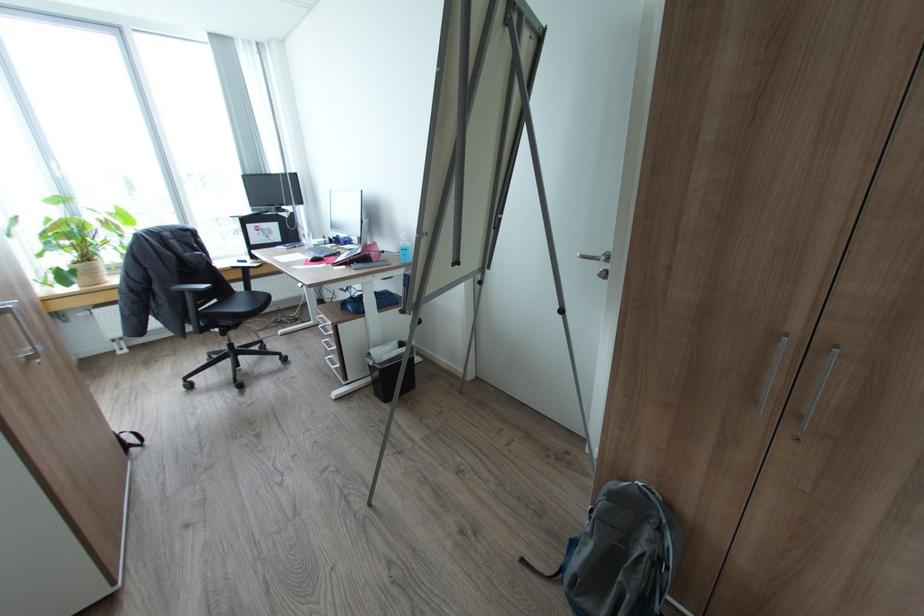
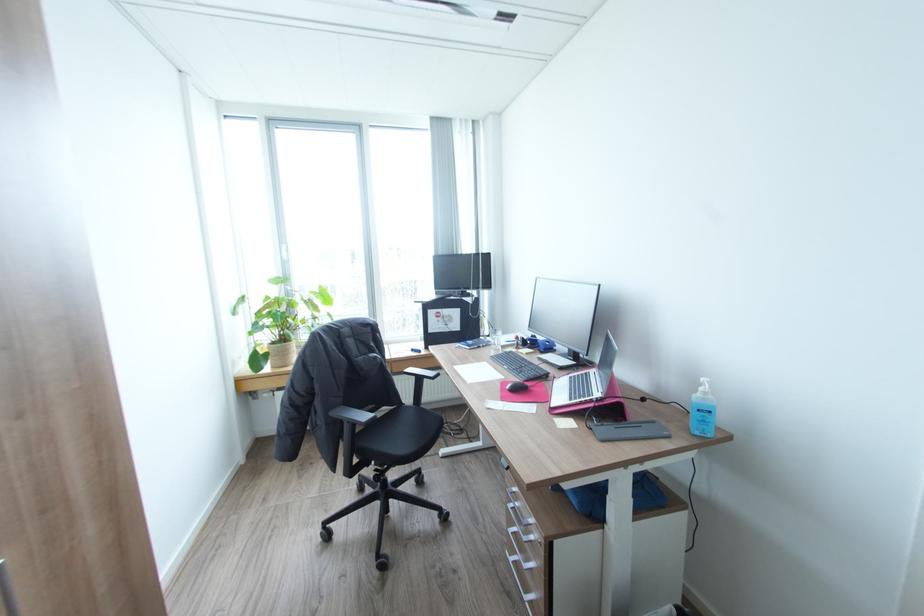
In the second image, find the point that corresponds to (313,243) in the first image.

(502, 344)